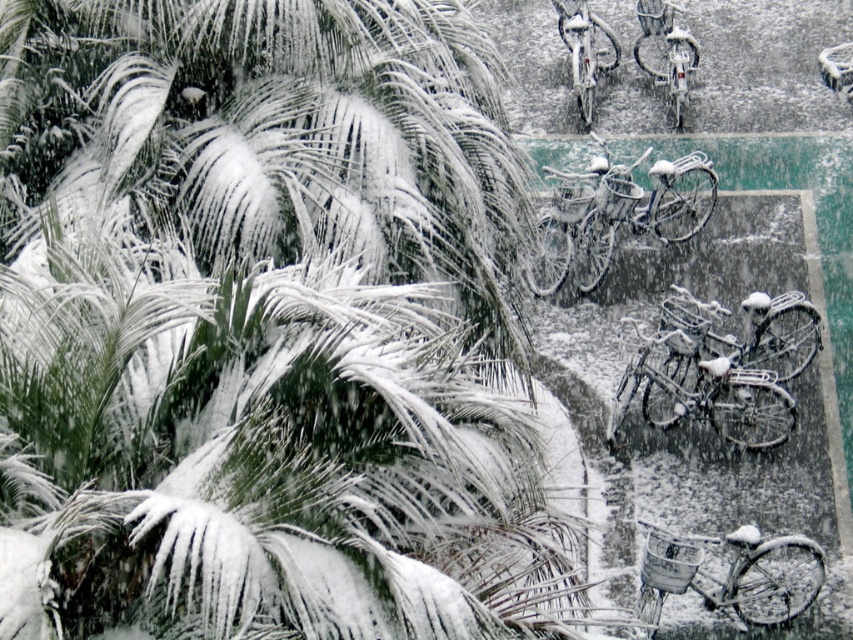
Question: Is metallic silver bicycle at upper right above metallic silver bicycle at center?

Choices:
 (A) no
 (B) yes

Answer: (A)

Question: Which of these objects is positioned farthest from the metallic silver bicycle at lower right?

Choices:
 (A) metallic silver bicycle at center
 (B) metallic silver bicycle at upper right
 (C) white frosty bicycle at center
 (D) snow-covered metallic bicycle at lower right

Answer: (A)

Question: Is snow-covered metallic bicycle at lower right thinner than white frosty bicycle at center?

Choices:
 (A) yes
 (B) no

Answer: (B)

Question: Can you confirm if white frosty bicycle at center is wider than metallic silver bicycle at upper right?

Choices:
 (A) yes
 (B) no

Answer: (A)

Question: Which object appears farthest from the camera in this image?

Choices:
 (A) metallic silver bicycle at lower right
 (B) snow-covered metallic bicycle at lower right

Answer: (B)

Question: Which point is closer to the camera?

Choices:
 (A) metallic silver bicycle at center
 (B) snow-covered metallic bicycle at lower right

Answer: (B)